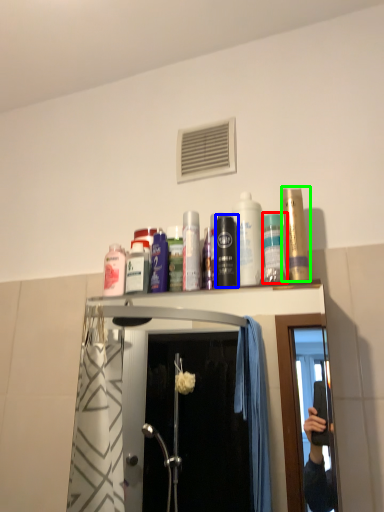
Question: Based on their relative distances, which object is farther from mouthwash (highlighted by a red box)? Choose from mouthwash (highlighted by a blue box) and mouthwash (highlighted by a green box).

Choices:
 (A) mouthwash
 (B) mouthwash

Answer: (A)